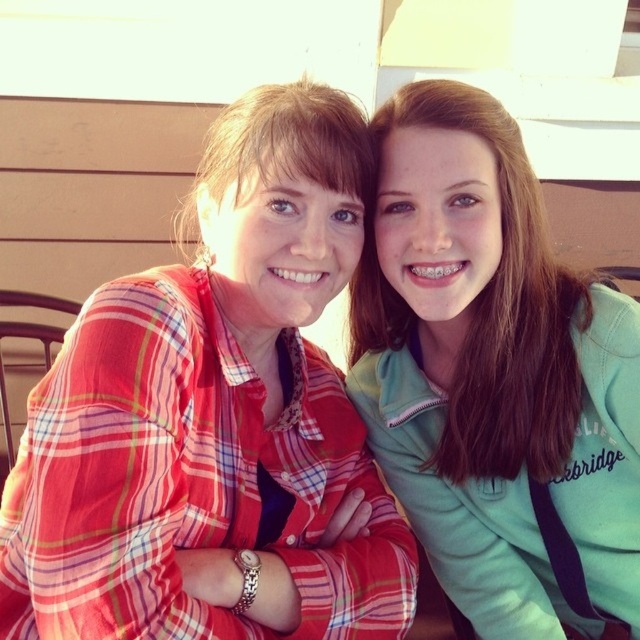
Question: Can you confirm if plaid shirt at center is positioned to the left of teal fleece jacket at upper right?

Choices:
 (A) yes
 (B) no

Answer: (A)

Question: Is plaid shirt at center smaller than teal fleece jacket at upper right?

Choices:
 (A) yes
 (B) no

Answer: (B)

Question: Is plaid shirt at center further to the viewer compared to teal fleece jacket at upper right?

Choices:
 (A) no
 (B) yes

Answer: (A)

Question: Which object is farther from the camera taking this photo?

Choices:
 (A) plaid shirt at center
 (B) teal fleece jacket at upper right

Answer: (B)